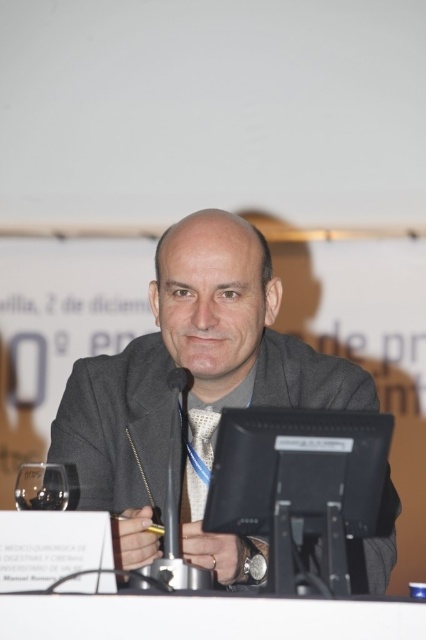
Based on the photo, you are organizing a meeting and need to place a nameplate between the black plastic table at lower center and the silver textured tie at center. According to the scene description, which object should the nameplate be placed closer to?

The nameplate should be placed closer to the silver textured tie at center because the black plastic table at lower center is positioned on the right side of the silver textured tie at center, meaning the tie is to the left of the table. Therefore, placing the nameplate near the tie would be between them.

You are a photographer setting up for a portrait session. You need to ensure that the gray woolen suit at center and the black plastic table at lower center are both visible in the frame. Based on their sizes, which object will appear larger in the photo?

The gray woolen suit at center is taller than the black plastic table at lower center, so it will appear larger in the photo.